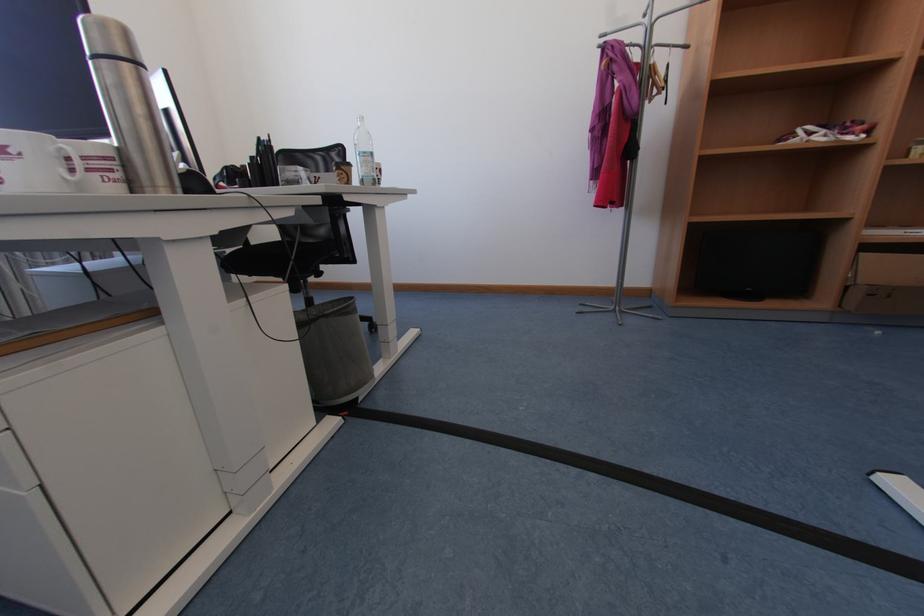
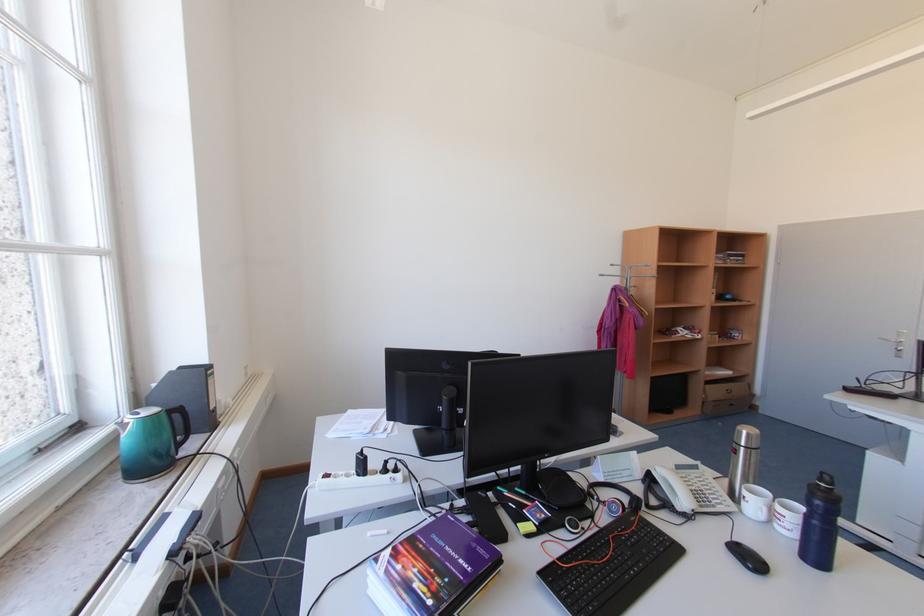
In the second image, find the point that corresponds to (x=617, y=31) in the first image.

(613, 275)